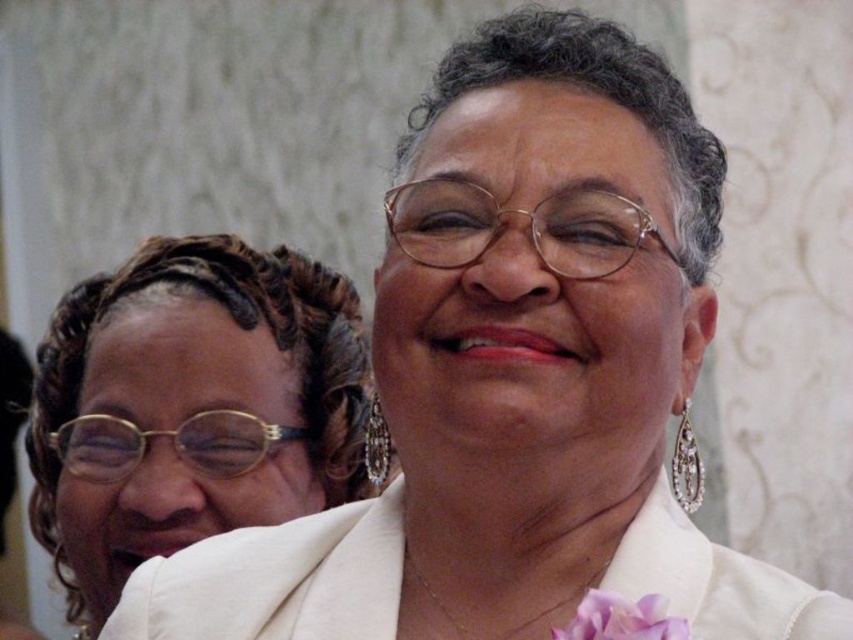
Question: Which object appears closest to the camera in this image?

Choices:
 (A) white satin robe at center
 (B) matte gold glasses at upper left
 (C) purple silk flower at lower center

Answer: (C)

Question: Can you confirm if matte gold glasses at upper left is smaller than white satin robe at center?

Choices:
 (A) yes
 (B) no

Answer: (B)

Question: Which point is closer to the camera?

Choices:
 (A) white satin robe at center
 (B) purple silk flower at lower center
 (C) matte gold glasses at upper left

Answer: (B)

Question: Is matte gold glasses at upper left smaller than white satin robe at center?

Choices:
 (A) yes
 (B) no

Answer: (B)

Question: Which object appears closest to the camera in this image?

Choices:
 (A) purple silk flower at lower center
 (B) matte gold glasses at upper left

Answer: (A)

Question: Does matte gold glasses at upper left lie in front of purple silk flower at lower center?

Choices:
 (A) yes
 (B) no

Answer: (B)